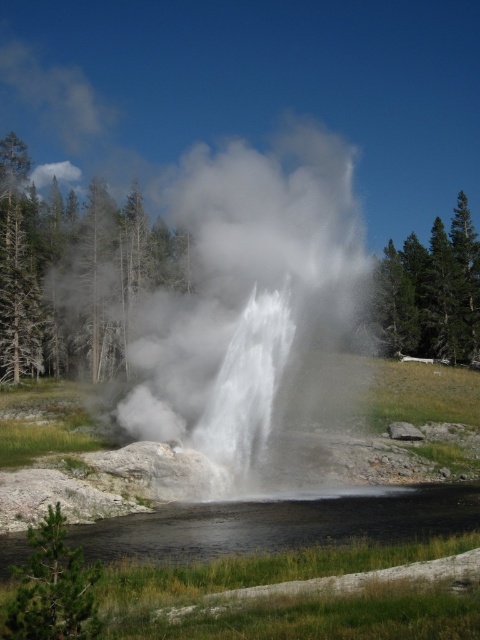
Question: Which point is farther from the camera taking this photo?

Choices:
 (A) (360, 515)
 (B) (286, 145)

Answer: (B)

Question: Which object is closer to the camera taking this photo?

Choices:
 (A) white vapor at center
 (B) black glossy water at center

Answer: (B)

Question: Is white vapor at center smaller than black glossy water at center?

Choices:
 (A) yes
 (B) no

Answer: (B)

Question: Which point is farther from the camera taking this photo?

Choices:
 (A) (3, 545)
 (B) (286, 152)

Answer: (B)

Question: Is the position of white vapor at center more distant than that of black glossy water at center?

Choices:
 (A) yes
 (B) no

Answer: (A)

Question: Is white vapor at center smaller than black glossy water at center?

Choices:
 (A) yes
 (B) no

Answer: (B)